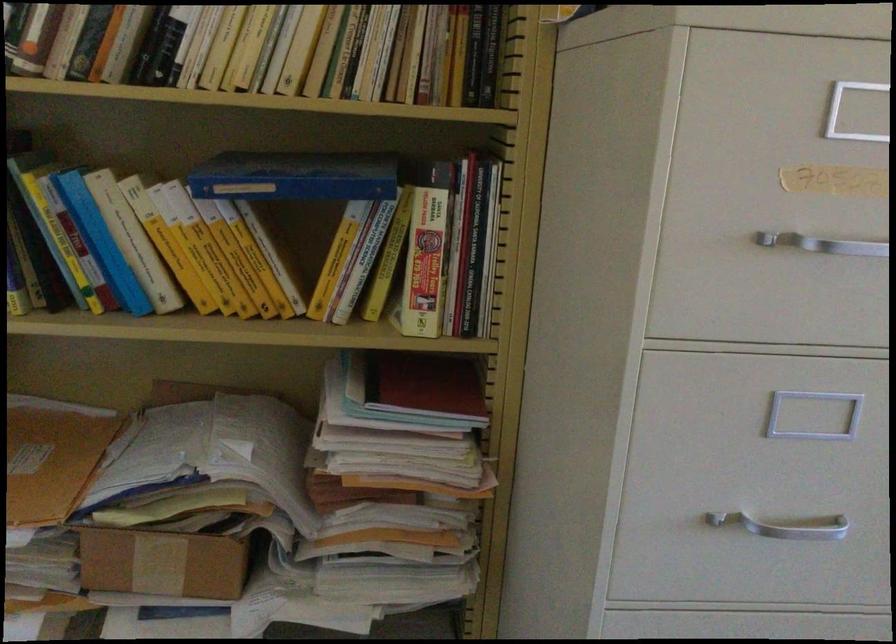
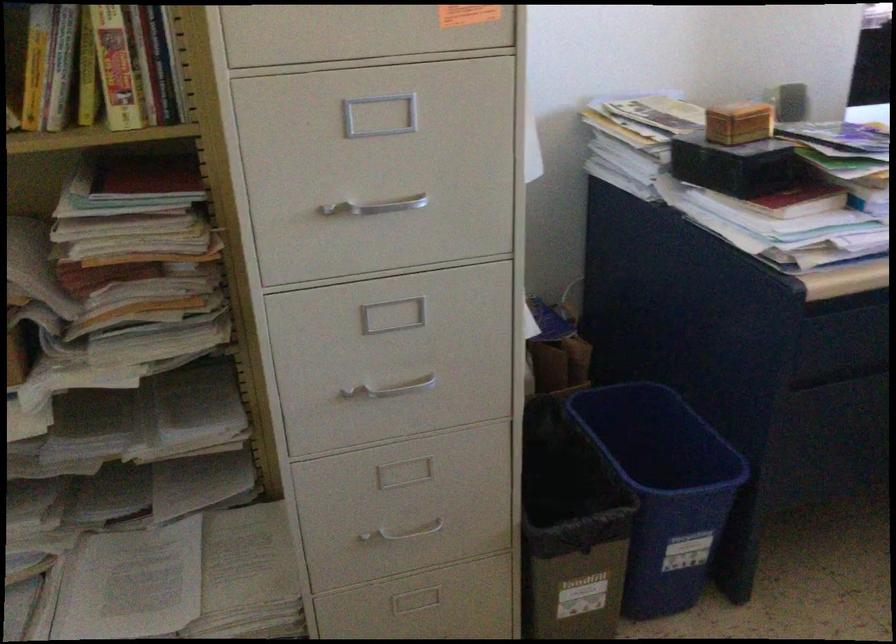
The images are taken continuously from a first-person perspective. In which direction are you moving?

The movement direction of the cameraman is right, backward.